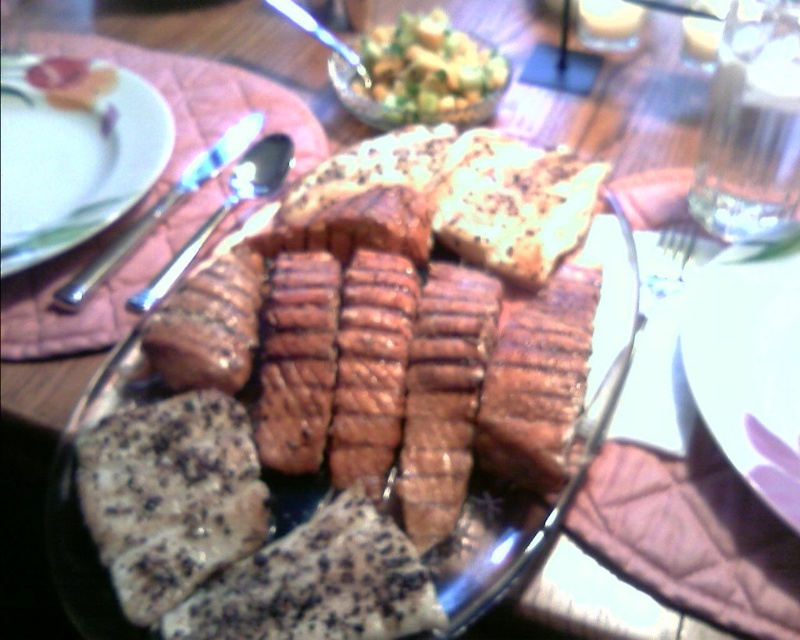
You are setting the table and need to place a napkin between the white glossy plate at upper left and the satin silver knife at upper left. Based on their positions, where should you place the napkin?

The white glossy plate at upper left is to the left of the satin silver knife at upper left, so you should place the napkin to the right of the white glossy plate at upper left and to the left of the satin silver knife at upper left between them.

You are setting the table for a barbecue dinner and need to place the white glossy plate at upper left and the satin silver knife at upper left. According to the image, which item should be placed higher up on the table?

The white glossy plate at upper left should be placed higher up on the table since it is located above the satin silver knife at upper left in the image.

You are a food photographer planning to take a photo of the brown glazed meat at center and the white glossy plate at upper left. Which object should you focus on first if you want to highlight the larger one in your shot?

The brown glazed meat at center is larger than the white glossy plate at upper left, so you should focus on the brown glazed meat at center first to highlight its size in the photo.